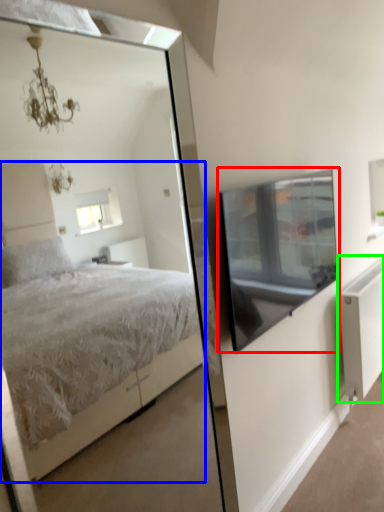
Question: Which object is the closest to the window screen (highlighted by a red box)? Choose among these: bed (highlighted by a blue box) or radiator (highlighted by a green box).

Choices:
 (A) bed
 (B) radiator

Answer: (B)